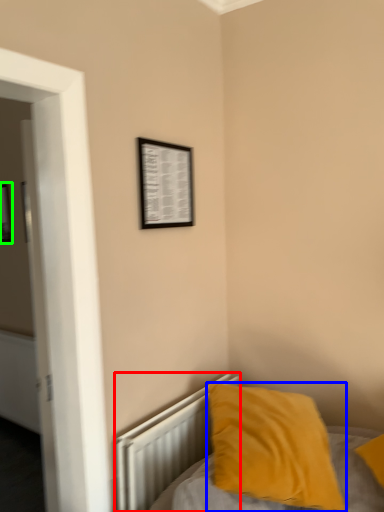
Question: Based on their relative distances, which object is nearer to radiator (highlighted by a red box)? Choose from pillow (highlighted by a blue box) and picture frame (highlighted by a green box).

Choices:
 (A) pillow
 (B) picture frame

Answer: (A)